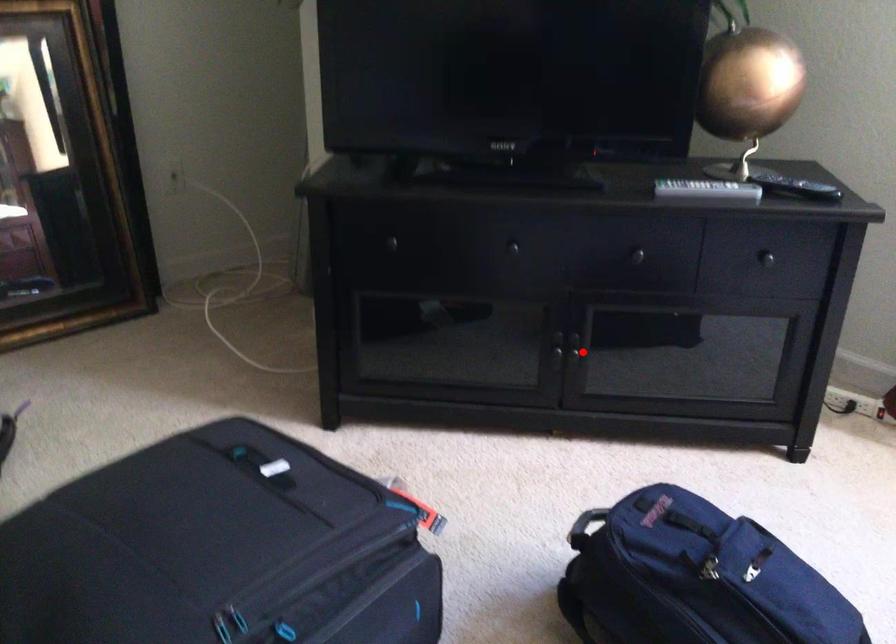
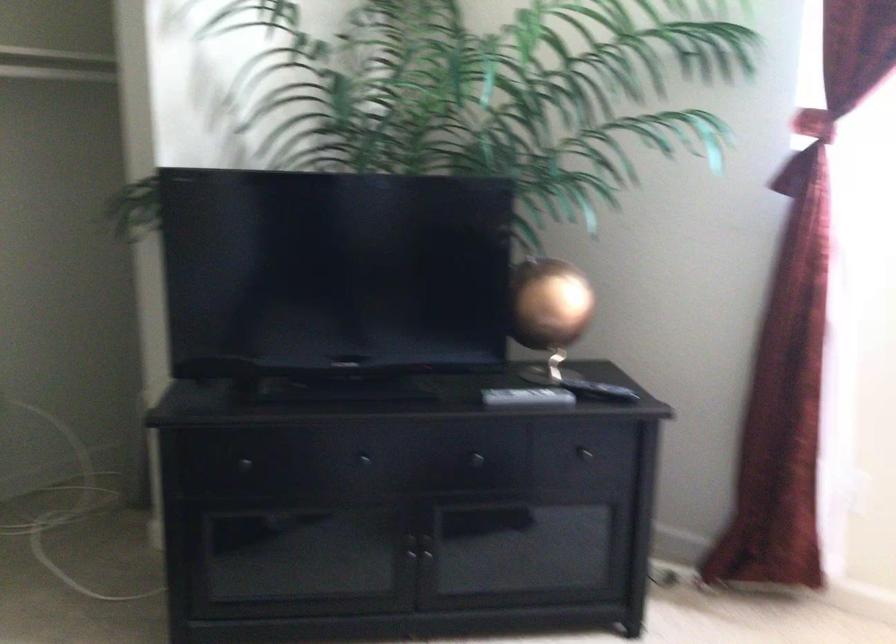
Question: I am providing you with two images of the same scene from different viewpoints. A red point is marked on the first image. Is the red point's position out of view in image 2?

Choices:
 (A) Yes
 (B) No

Answer: (B)